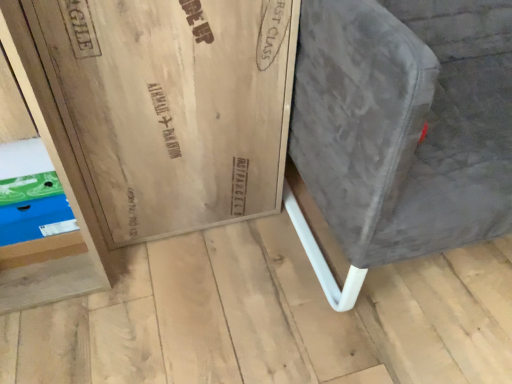
Question: Looking at their shapes, would you say blue cardboard shoebox at lower left is wider or thinner than velvet grey armchair at right?

Choices:
 (A) thin
 (B) wide

Answer: (A)

Question: In the image, is blue cardboard shoebox at lower left on the left side or the right side of velvet grey armchair at right?

Choices:
 (A) left
 (B) right

Answer: (A)

Question: Based on their sizes in the image, would you say blue cardboard shoebox at lower left is bigger or smaller than velvet grey armchair at right?

Choices:
 (A) big
 (B) small

Answer: (B)

Question: In terms of height, does velvet grey armchair at right look taller or shorter compared to blue cardboard shoebox at lower left?

Choices:
 (A) short
 (B) tall

Answer: (B)

Question: Considering the positions of velvet grey armchair at right and blue cardboard shoebox at lower left in the image, is velvet grey armchair at right wider or thinner than blue cardboard shoebox at lower left?

Choices:
 (A) thin
 (B) wide

Answer: (B)

Question: Considering the positions of point (418, 210) and point (18, 168), is point (418, 210) closer or farther from the camera than point (18, 168)?

Choices:
 (A) closer
 (B) farther

Answer: (A)

Question: Considering the positions of velvet grey armchair at right and blue cardboard shoebox at lower left in the image, is velvet grey armchair at right bigger or smaller than blue cardboard shoebox at lower left?

Choices:
 (A) small
 (B) big

Answer: (B)